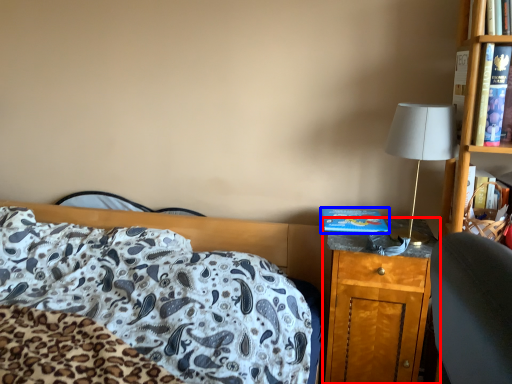
Question: Which object appears farthest to the camera in this image, nightstand (highlighted by a red box) or hardback book (highlighted by a blue box)?

Choices:
 (A) nightstand
 (B) hardback book

Answer: (B)